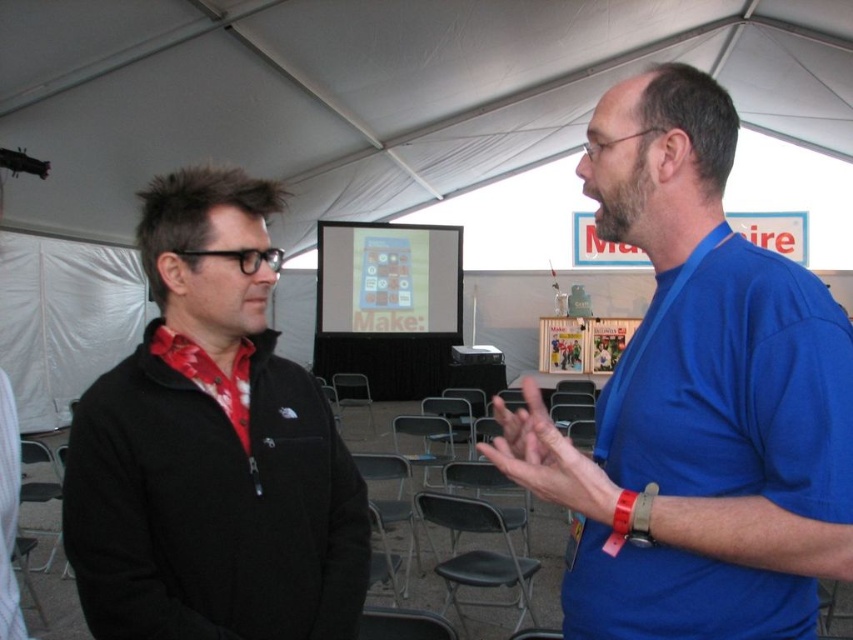
Is the position of blue fabric shirt at right less distant than that of black fleece jacket at left?

Yes, it is in front of black fleece jacket at left.

Does blue fabric shirt at right have a greater width compared to black fleece jacket at left?

Yes.

Does point (767, 385) come in front of point (292, 388)?

Yes, point (767, 385) is in front of point (292, 388).

You are a GUI agent. You are given a task and a screenshot of the screen. Output one action in this format:
    pyautogui.click(x=<x>, y=<y>)
    Task: Click on the blue fabric shirt at right
    This screenshot has width=853, height=640.
    Given the screenshot: What is the action you would take?
    pyautogui.click(x=698, y=401)